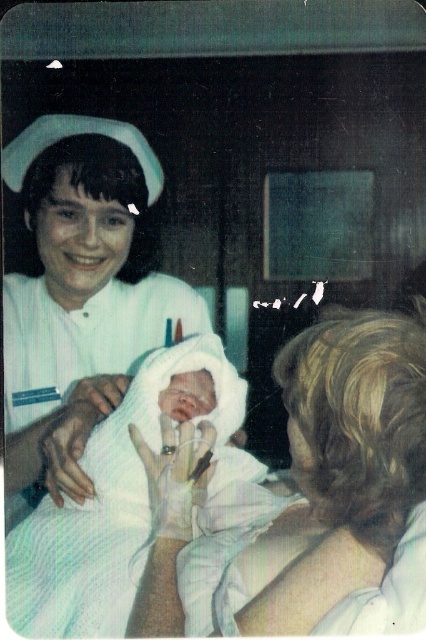
How distant is smooth white towel at center from white smooth nurse cap at upper left?

smooth white towel at center is 10.69 inches from white smooth nurse cap at upper left.

Does smooth white towel at center have a smaller size compared to white smooth nurse cap at upper left?

Actually, smooth white towel at center might be larger than white smooth nurse cap at upper left.

You are a GUI agent. You are given a task and a screenshot of the screen. Output one action in this format:
    pyautogui.click(x=<x>, y=<y>)
    Task: Click on the smooth white towel at center
    The height and width of the screenshot is (640, 426).
    Given the screenshot: What is the action you would take?
    pyautogui.click(x=302, y=499)